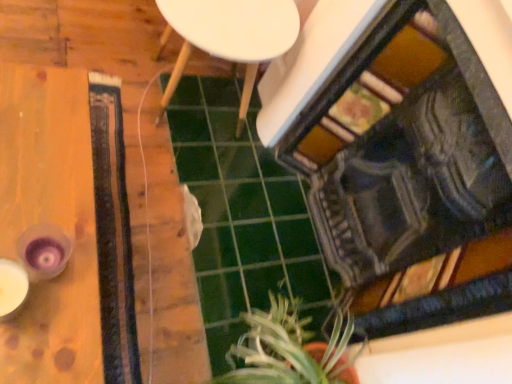
Question: Is the position of white matte side table at center more distant than that of wooden table at left?

Choices:
 (A) yes
 (B) no

Answer: (A)

Question: Is white matte side table at center far from wooden table at left?

Choices:
 (A) no
 (B) yes

Answer: (A)

Question: From the image's perspective, is white matte side table at center located beneath wooden table at left?

Choices:
 (A) no
 (B) yes

Answer: (A)

Question: Does white matte side table at center appear on the right side of wooden table at left?

Choices:
 (A) yes
 (B) no

Answer: (A)

Question: From a real-world perspective, is white matte side table at center physically below wooden table at left?

Choices:
 (A) yes
 (B) no

Answer: (B)

Question: Is white matte side table at center smaller than wooden table at left?

Choices:
 (A) no
 (B) yes

Answer: (A)

Question: Considering the relative positions of wooden table at left and green leafy plant at lower center in the image provided, is wooden table at left to the right of green leafy plant at lower center from the viewer's perspective?

Choices:
 (A) yes
 (B) no

Answer: (B)

Question: Is the position of wooden table at left more distant than that of green leafy plant at lower center?

Choices:
 (A) no
 (B) yes

Answer: (A)

Question: Considering the relative sizes of wooden table at left and green leafy plant at lower center in the image provided, is wooden table at left smaller than green leafy plant at lower center?

Choices:
 (A) no
 (B) yes

Answer: (A)

Question: Is wooden table at left located outside green leafy plant at lower center?

Choices:
 (A) yes
 (B) no

Answer: (A)

Question: Is wooden table at left at the left side of green leafy plant at lower center?

Choices:
 (A) no
 (B) yes

Answer: (B)

Question: Are wooden table at left and green leafy plant at lower center making contact?

Choices:
 (A) yes
 (B) no

Answer: (B)

Question: Does green leafy plant at lower center have a lesser height compared to white matte side table at center?

Choices:
 (A) no
 (B) yes

Answer: (B)